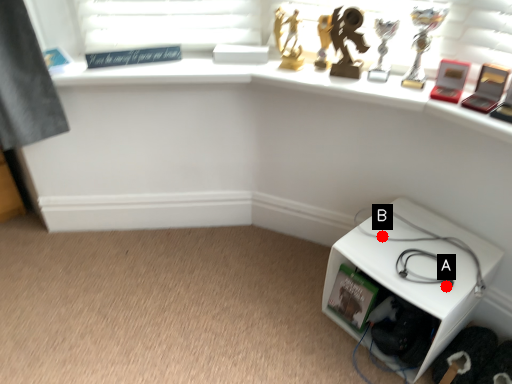
Question: Two points are circled on the image, labeled by A and B beside each circle. Among these points, which one is farthest from the camera?

Choices:
 (A) A is further
 (B) B is further

Answer: (B)